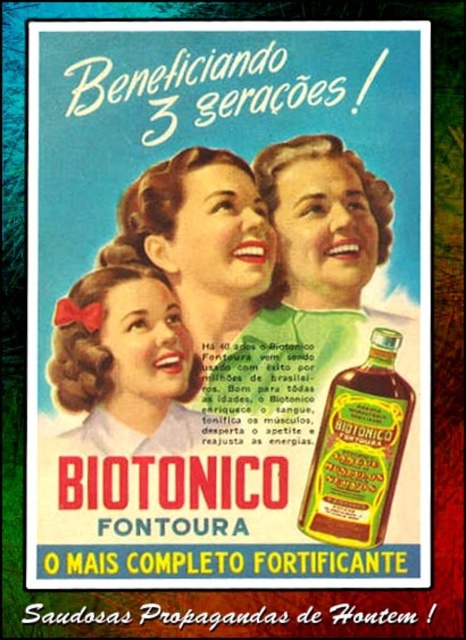
Consider the image. You are looking at the vintage advertisement for Biotonico Fontoura. There is a matte green dress at center and a matte white blouse at center. Which one is positioned to the right?

The matte green dress at center is positioned to the right of the matte white blouse at center.

You are standing 5 feet away from the advertisement. There is a point at coordinates point (155, 166). Can you reach it without moving closer?

The point at coordinates point (155, 166) is only 4.35 feet away from the viewer, so yes, you can reach it without moving closer since you are already 5 feet away.

You are a tailor trying to determine if a matte white blouse at center can fit into a storage box designed for the matte green dress at center. Based on the image description, can the blouse fit into the dress box?

The matte green dress at center might be wider than matte white blouse at center, so the storage box designed for the dress may accommodate the blouse since the blouse is narrower.